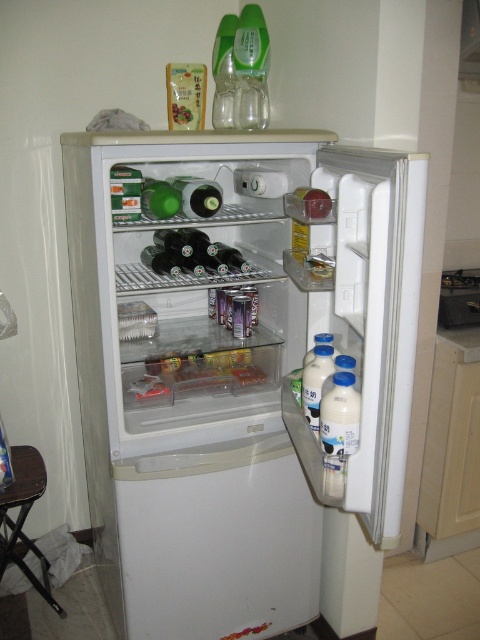
Question: Estimate the real-world distances between objects in this image. Which object is closer to the green glass bottle at center?

Choices:
 (A) white plastic fridge at center
 (B) brown wood stool at lower left

Answer: (A)

Question: Among these objects, which one is farthest from the camera?

Choices:
 (A) green glass bottle at center
 (B) white plastic fridge at center

Answer: (A)

Question: Considering the relative positions of white plastic fridge at center and brown wood stool at lower left in the image provided, where is white plastic fridge at center located with respect to brown wood stool at lower left?

Choices:
 (A) left
 (B) right

Answer: (B)

Question: Which point is farther to the camera?

Choices:
 (A) green glass bottle at center
 (B) white plastic fridge at center

Answer: (A)

Question: Is brown wood stool at lower left smaller than green glass bottle at center?

Choices:
 (A) no
 (B) yes

Answer: (A)

Question: Can you confirm if white plastic fridge at center is positioned to the right of brown wood stool at lower left?

Choices:
 (A) no
 (B) yes

Answer: (B)